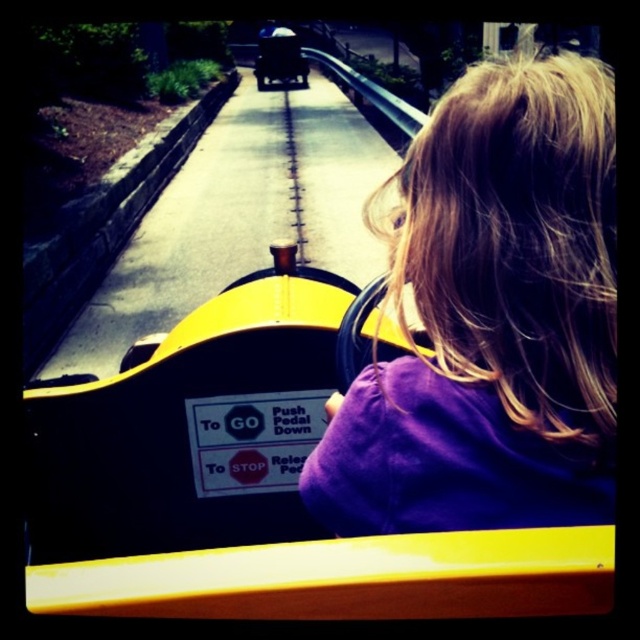
Question: Observing the image, what is the correct spatial positioning of purple fabric hair at center in reference to shiny black car at center?

Choices:
 (A) above
 (B) below

Answer: (B)

Question: Which object appears closest to the camera in this image?

Choices:
 (A) purple fabric hair at center
 (B) shiny black car at center

Answer: (A)

Question: Can you confirm if purple fabric hair at center is positioned to the right of shiny black car at center?

Choices:
 (A) no
 (B) yes

Answer: (B)

Question: Which of the following is the farthest from the observer?

Choices:
 (A) (525, 353)
 (B) (280, 29)

Answer: (B)

Question: In this image, where is purple fabric hair at center located relative to shiny black car at center?

Choices:
 (A) above
 (B) below

Answer: (B)